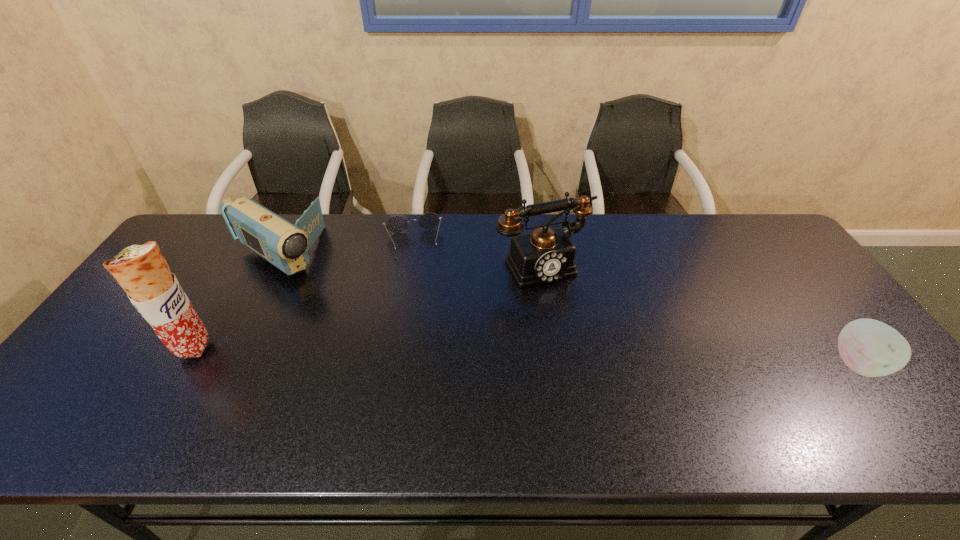
Choose which object is the third nearest neighbor to the third tallest object. Please provide its 2D coordinates. Your answer should be formatted as a tuple, i.e. [(x, y)], where the tuple contains the x and y coordinates of a point satisfying the conditions above.

[(546, 255)]

Locate an element on the screen. The image size is (960, 540). object that stands as the second closest to the tallest object is located at coordinates (397, 224).

What are the coordinates of `free point that satisfies the following two spatial constraints: 1. on the front side of the telephone; 2. on the left side of the camcorder` in the screenshot? It's located at click(x=275, y=263).